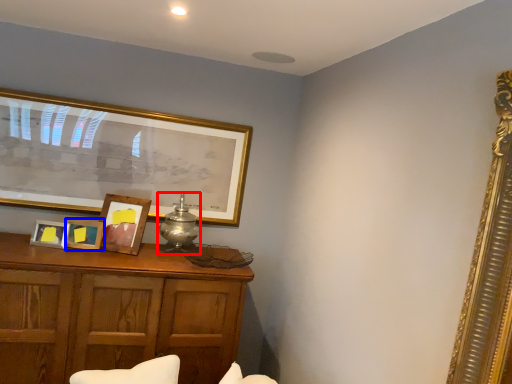
Question: Among these objects, which one is nearest to the camera, table lamp (highlighted by a red box) or picture frame (highlighted by a blue box)?

Choices:
 (A) table lamp
 (B) picture frame

Answer: (B)